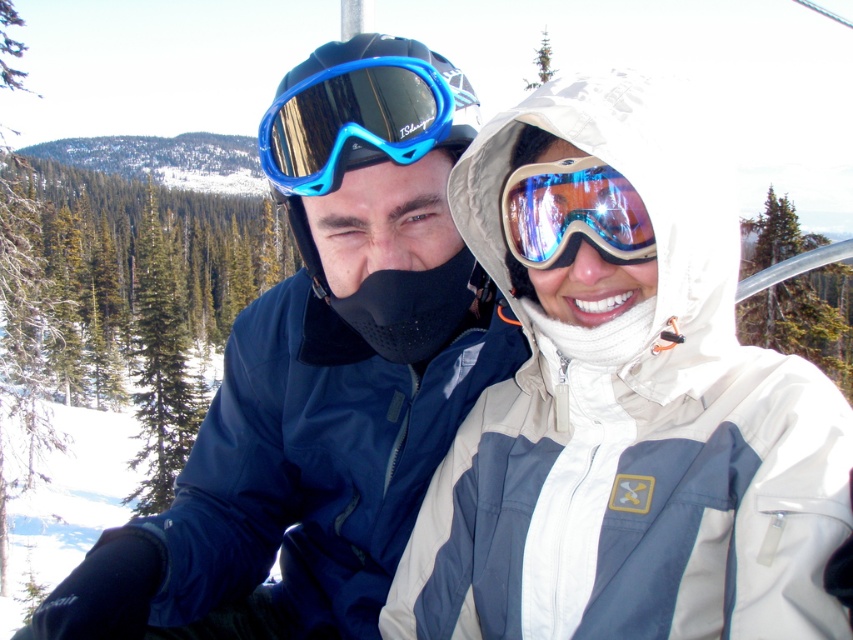
You are a photographer taking a picture of two skiers on a ski lift. You notice the matte blue ski goggles at center and the shiny reflective ski goggles at center. Which pair of goggles is on the left side when looking at the photo?

The matte blue ski goggles at center is positioned on the left side of the shiny reflective ski goggles at center, so the matte blue ski goggles at center is on the left side in the photo.

You are a photographer trying to capture a clear photo of the white matte jacket at center and the shiny reflective ski goggles at center. Considering their distance, will you be able to focus on both objects simultaneously in a single shot?

The white matte jacket at center is 9.68 inches away from the shiny reflective ski goggles at center. Since they are very close in proximity, the photographer can focus on both objects simultaneously in a single shot.

You are a photographer trying to capture a closeup shot of both the matte blue ski goggles at center and the shiny reflective ski goggles at center. Given that your camera can only focus on one pair of goggles at a time, which pair should you adjust the focus for first if you want to ensure the wider pair is in sharp detail?

The matte blue ski goggles at center are wider than the shiny reflective ski goggles at center. Therefore, to ensure the wider pair is in sharp detail, you should first adjust the focus for the matte blue ski goggles at center.